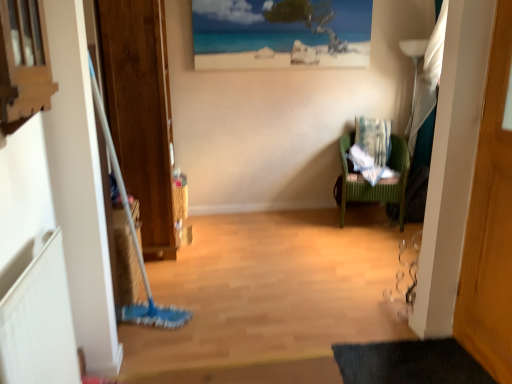
Locate an element on the screen. This screenshot has width=512, height=384. free space in front of wooden screen door at left is located at coordinates (187, 276).